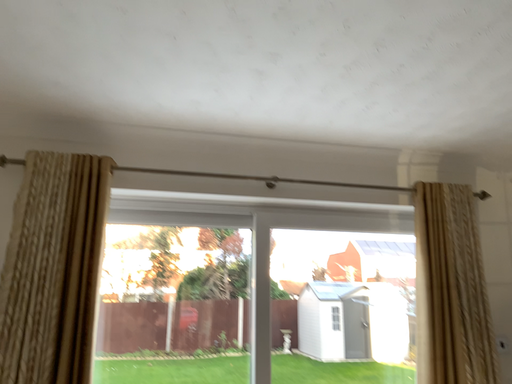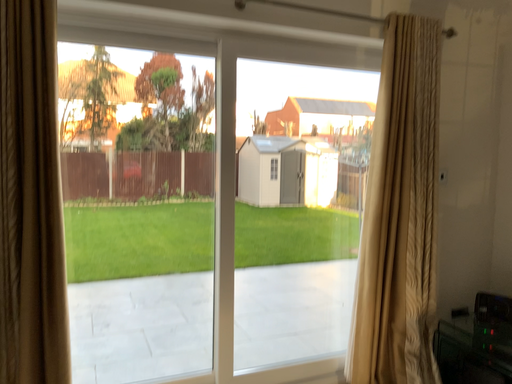
Question: How did the camera likely rotate when shooting the video?

Choices:
 (A) rotated right
 (B) rotated left

Answer: (A)